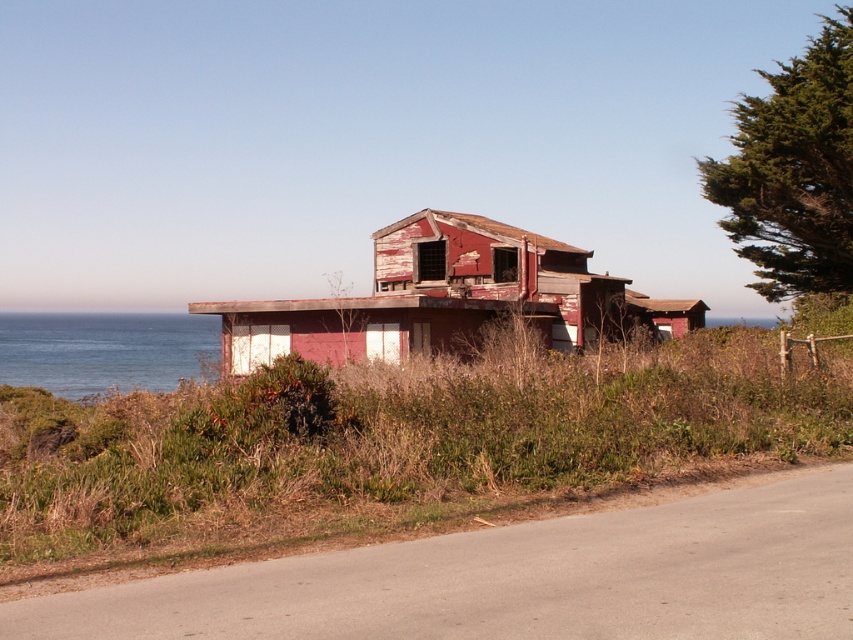
Who is positioned more to the left, rusty metal shack at center or peeling paint wooden hut at center?

rusty metal shack at center

Does rusty metal shack at center appear on the right side of peeling paint wooden hut at center?

Incorrect, rusty metal shack at center is not on the right side of peeling paint wooden hut at center.

Between point (650, 426) and point (550, 312), which one is positioned behind?

The point (550, 312) is more distant.

This screenshot has width=853, height=640. In order to click on rusty metal shack at center in this screenshot , I will do `click(392, 448)`.

Does rusty metal shack at center have a smaller size compared to blue water at left?

Yes.

Is rusty metal shack at center wider than blue water at left?

No.

Is point (816, 392) more distant than point (20, 369)?

No, (816, 392) is in front of (20, 369).

Locate an element on the screen. rusty metal shack at center is located at coordinates (392, 448).

Is point (401, 262) less distant than point (138, 372)?

Yes, it is.

Is peeling paint wooden hut at center shorter than blue water at left?

No.

This screenshot has height=640, width=853. Describe the element at coordinates (442, 298) in the screenshot. I see `peeling paint wooden hut at center` at that location.

Identify the location of peeling paint wooden hut at center. (442, 298).